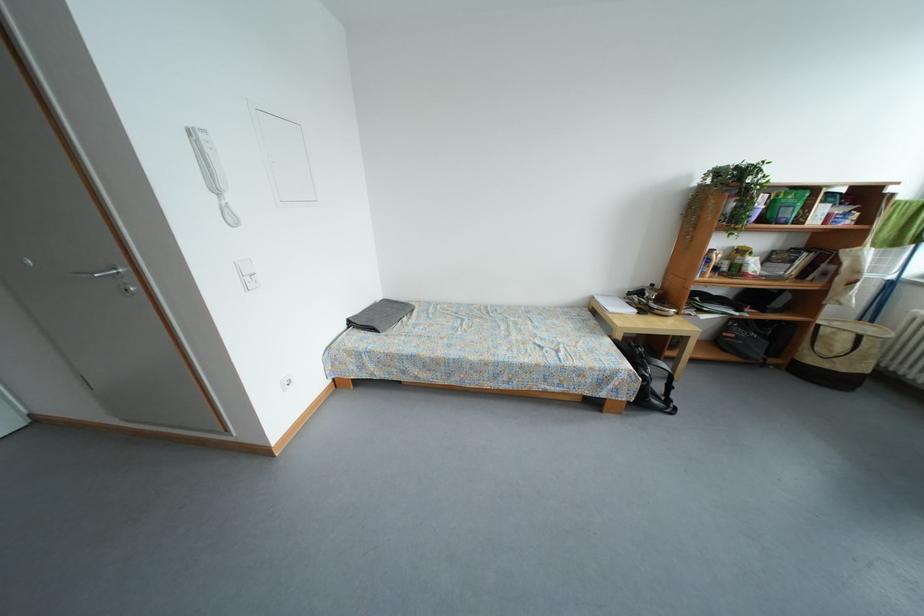
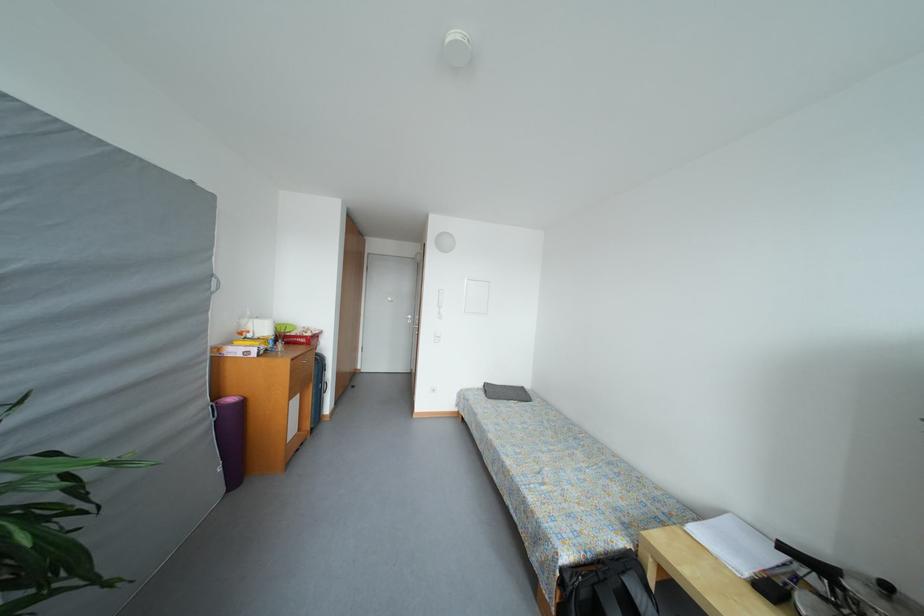
Find the pixel in the second image that matches (x=659, y=290) in the first image.

(893, 591)